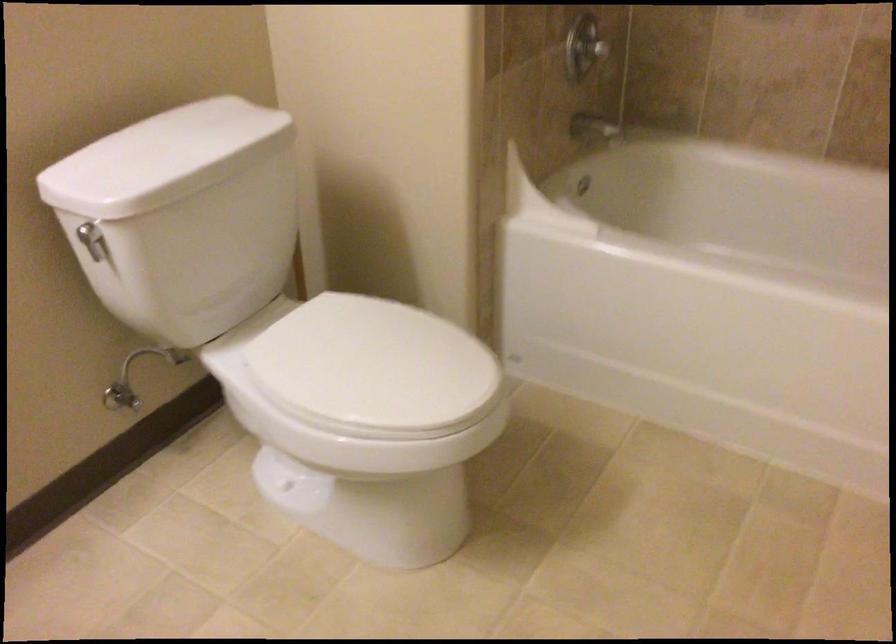
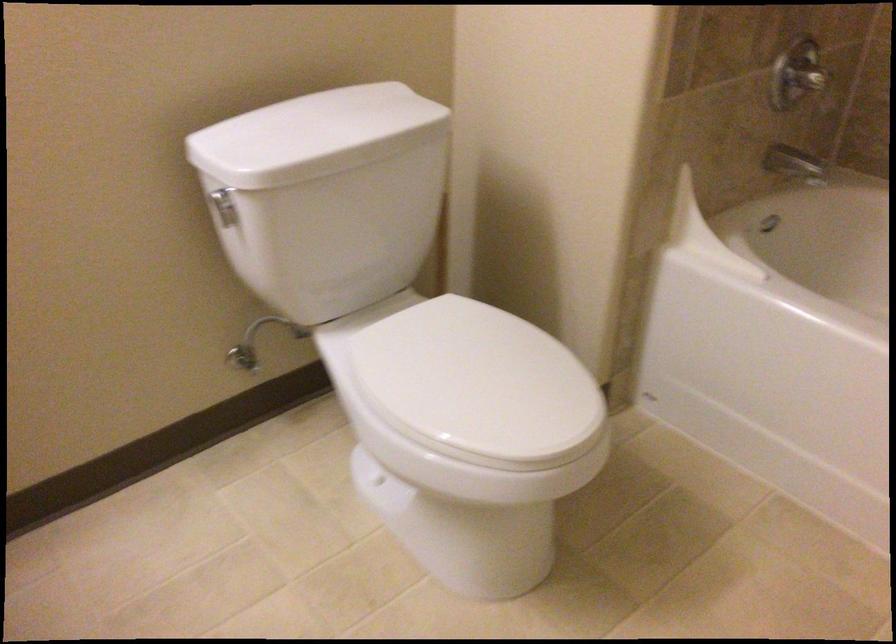
The point at (209, 127) is marked in the first image. Where is the corresponding point in the second image?

(366, 109)